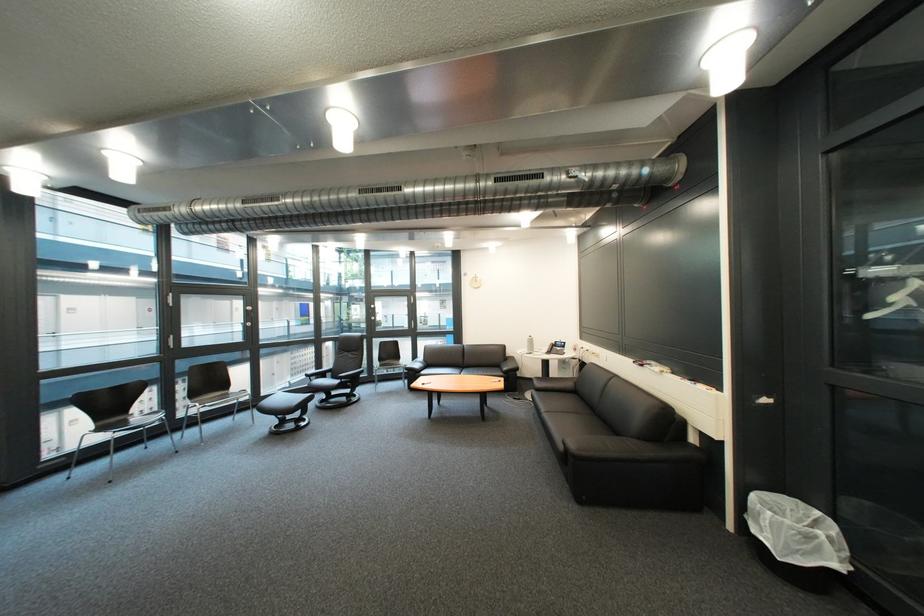
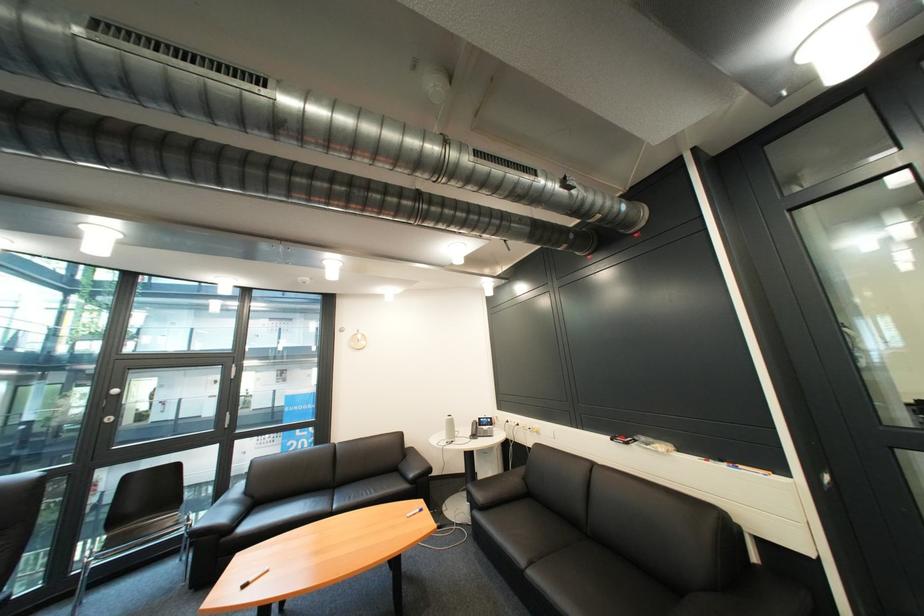
The point at (701, 384) is marked in the first image. Where is the corresponding point in the second image?

(736, 468)